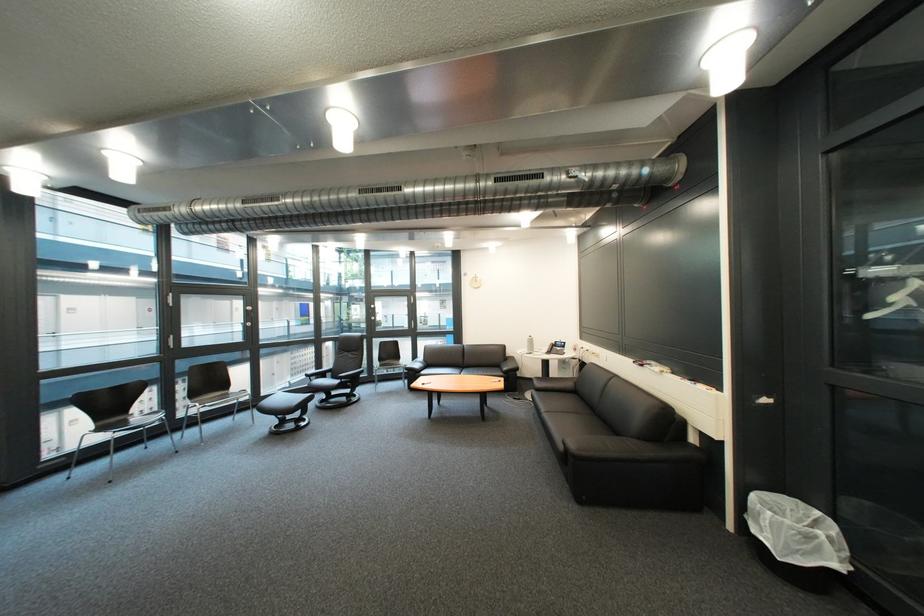
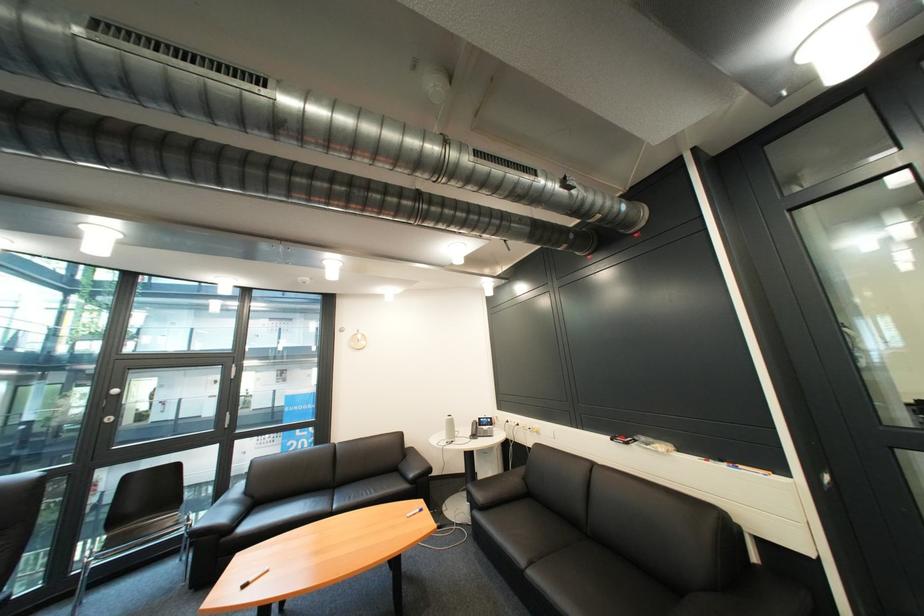
The point at (701, 384) is marked in the first image. Where is the corresponding point in the second image?

(736, 468)